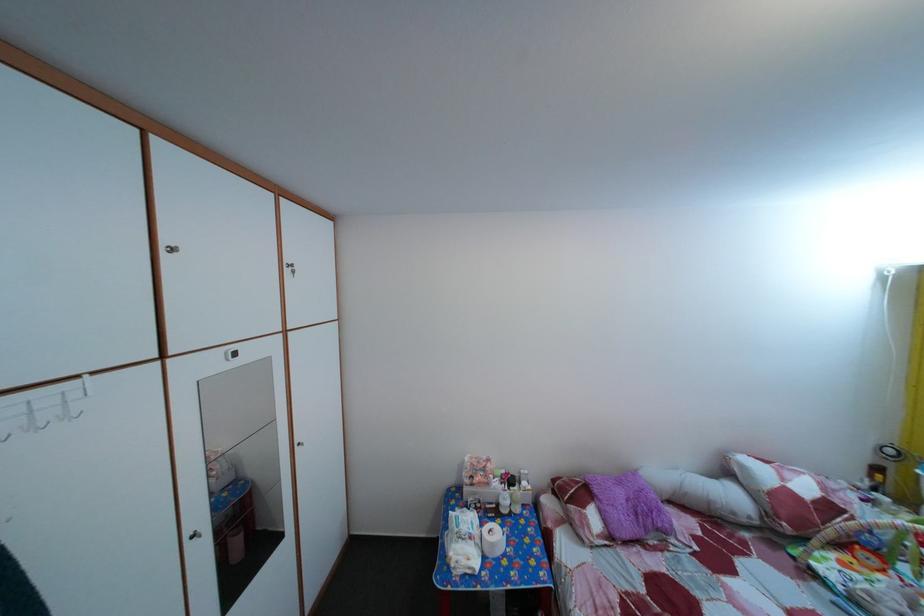
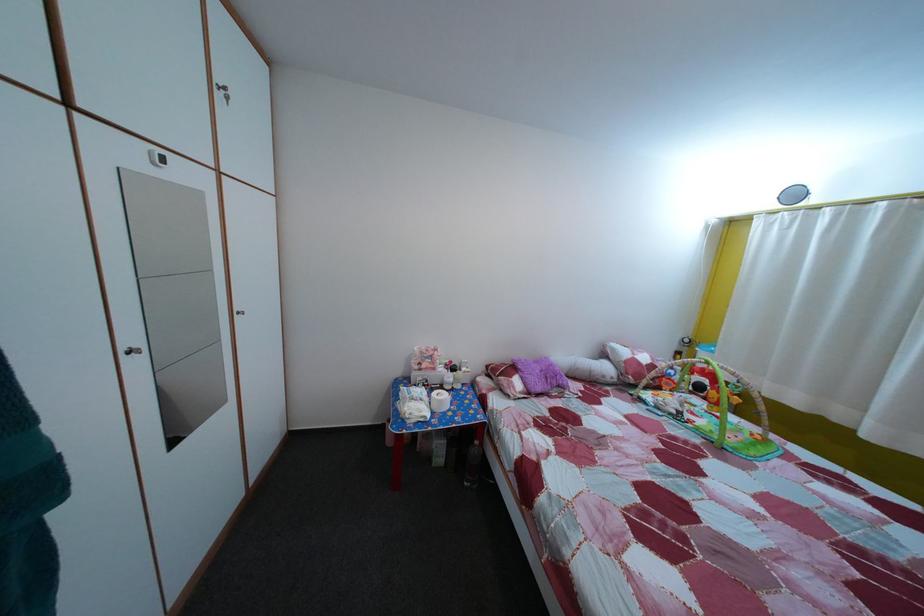
Question: The first image is from the beginning of the video and the second image is from the end. How did the camera likely rotate when shooting the video?

Choices:
 (A) Left
 (B) Right
 (C) Up
 (D) Down

Answer: (B)